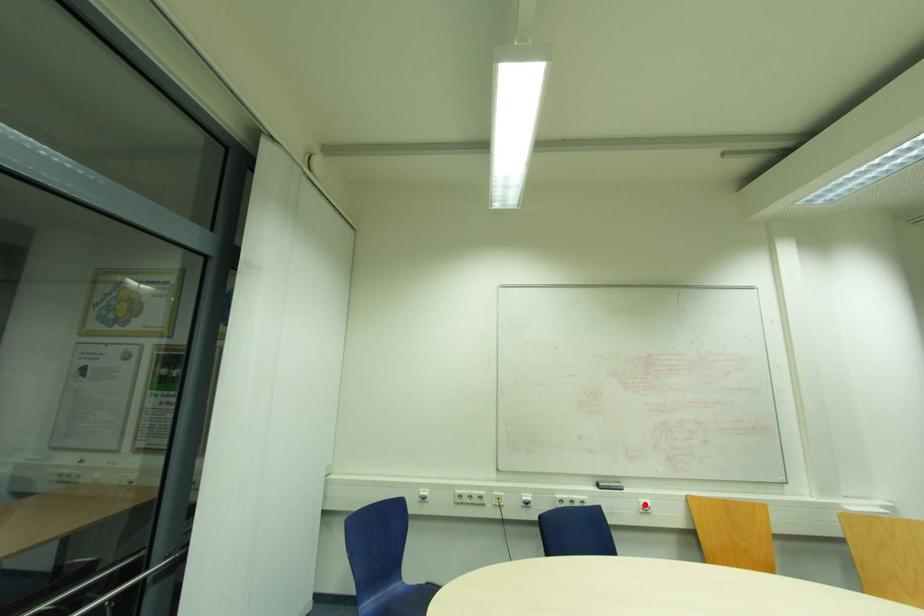
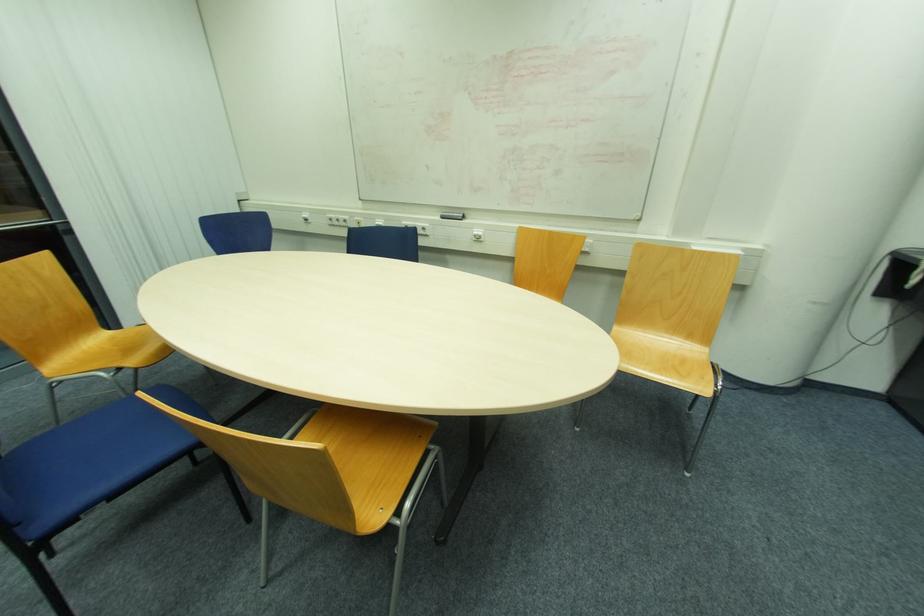
Find the pixel in the second image that matches the highlighted location in the first image.

(477, 233)